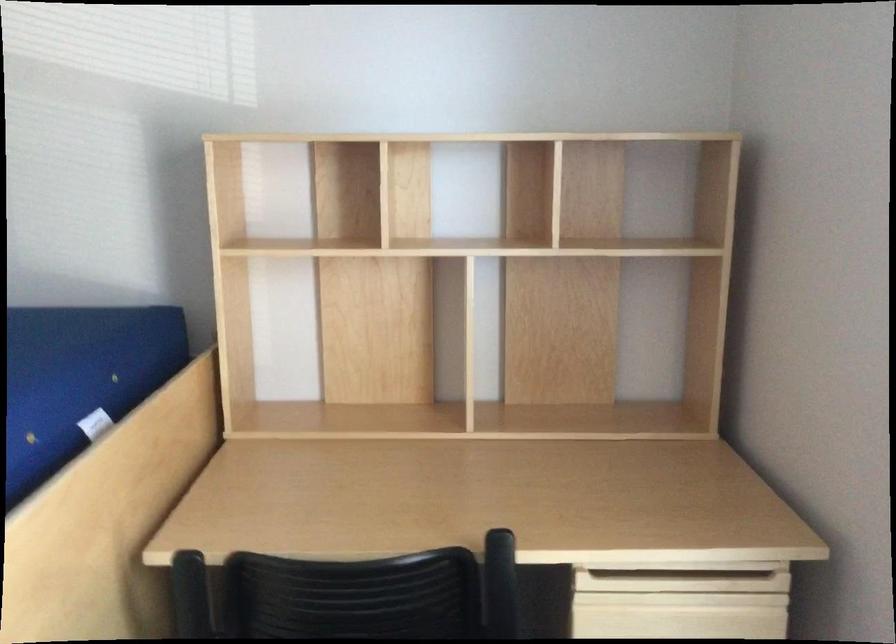
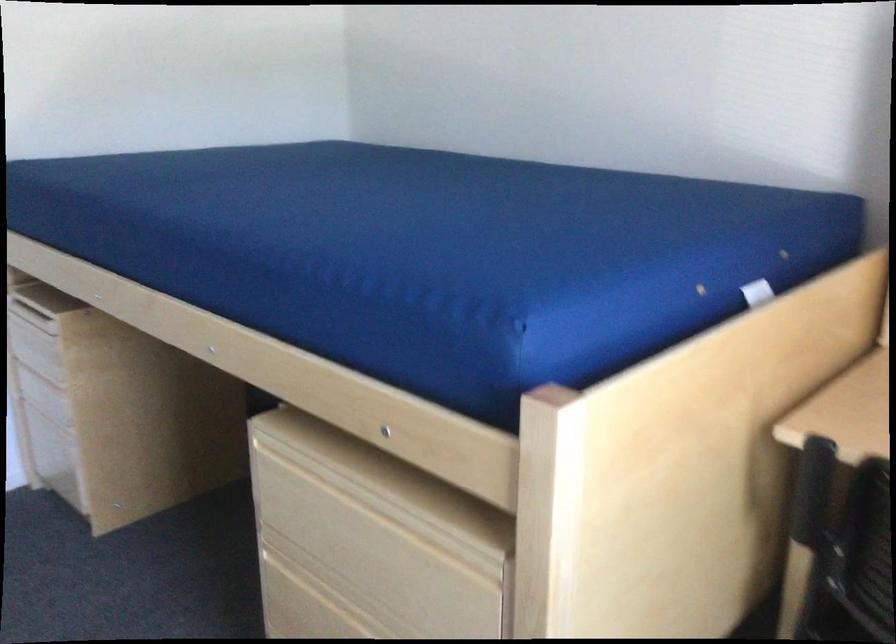
Question: The camera is either moving clockwise (left) or counter-clockwise (right) around the object. The first image is from the beginning of the video and the second image is from the end. Is the camera moving left or right when shooting the video?

Choices:
 (A) Left
 (B) Right

Answer: (B)